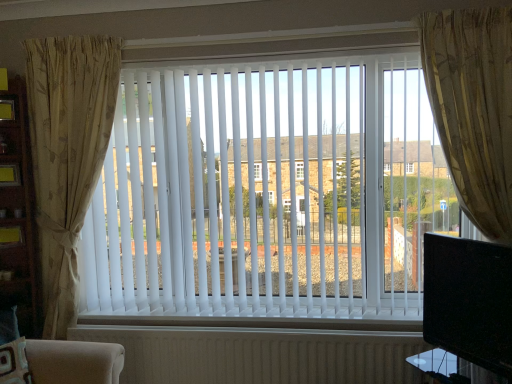
Describe the element at coordinates (267, 193) in the screenshot. The height and width of the screenshot is (384, 512). I see `white plastic blinds at center` at that location.

This screenshot has height=384, width=512. Describe the element at coordinates (67, 153) in the screenshot. I see `beige floral fabric curtain at left, which is the 1th curtain from left to right` at that location.

How much space does beige floral fabric curtain at left, which is the 1th curtain from left to right, occupy horizontally?

beige floral fabric curtain at left, which is the 1th curtain from left to right, is 5.63 inches in width.

Find the location of `white ribbed radiator at bottom`. white ribbed radiator at bottom is located at coordinates tap(259, 354).

Is white plastic blinds at center further to the viewer compared to beige floral fabric curtain at left, which ranks as the 2th curtain in right-to-left order?

No, the depth of white plastic blinds at center is less than that of beige floral fabric curtain at left, which ranks as the 2th curtain in right-to-left order.

Who is taller, white plastic blinds at center or beige floral fabric curtain at left, which ranks as the 2th curtain in right-to-left order?

Standing taller between the two is beige floral fabric curtain at left, which ranks as the 2th curtain in right-to-left order.

Considering the relative positions of white plastic blinds at center and beige floral fabric curtain at left, which ranks as the 2th curtain in right-to-left order, in the image provided, is white plastic blinds at center to the left or to the right of beige floral fabric curtain at left, which ranks as the 2th curtain in right-to-left order,?

Based on their positions, white plastic blinds at center is located to the right of beige floral fabric curtain at left, which ranks as the 2th curtain in right-to-left order.

Considering the relative sizes of white plastic blinds at center and beige floral fabric curtain at left, which ranks as the 2th curtain in right-to-left order, in the image provided, is white plastic blinds at center smaller than beige floral fabric curtain at left, which ranks as the 2th curtain in right-to-left order,?

Incorrect, white plastic blinds at center is not smaller in size than beige floral fabric curtain at left, which ranks as the 2th curtain in right-to-left order.

From the image's perspective, between white ribbed radiator at bottom and black glossy tv at right, which one is located above?

black glossy tv at right, from the image's perspective.

Can you confirm if white ribbed radiator at bottom is wider than black glossy tv at right?

Incorrect, the width of white ribbed radiator at bottom does not surpass that of black glossy tv at right.

Is white ribbed radiator at bottom bigger than black glossy tv at right?

Yes.

Is white ribbed radiator at bottom not inside black glossy tv at right?

Yes, white ribbed radiator at bottom is located beyond the bounds of black glossy tv at right.

The image size is (512, 384). Find the location of `curtain that is the 1st object above the white ribbed radiator at bottom (from a real-world perspective)`. curtain that is the 1st object above the white ribbed radiator at bottom (from a real-world perspective) is located at coordinates (67, 153).

Is point (207, 349) more distant than point (75, 203)?

Yes, point (207, 349) is behind point (75, 203).

Is white ribbed radiator at bottom positioned far away from beige floral fabric curtain at left, which is the 1th curtain from left to right?

That's right, there is a large distance between white ribbed radiator at bottom and beige floral fabric curtain at left, which is the 1th curtain from left to right.

Based on the photo, which is more to the left, white ribbed radiator at bottom or beige floral fabric curtain at left, which ranks as the 2th curtain in right-to-left order?

beige floral fabric curtain at left, which ranks as the 2th curtain in right-to-left order.

Is gold textured curtain at right, the 2th curtain viewed from the left, thinner than white ribbed radiator at bottom?

Incorrect, the width of gold textured curtain at right, the 2th curtain viewed from the left, is not less than that of white ribbed radiator at bottom.

Is point (493, 18) positioned before point (316, 329)?

Yes, it is in front of point (316, 329).

Are gold textured curtain at right, marked as the first curtain in a right-to-left arrangement, and white ribbed radiator at bottom beside each other?

No, gold textured curtain at right, marked as the first curtain in a right-to-left arrangement, is not in contact with white ribbed radiator at bottom.

What's the angular difference between gold textured curtain at right, marked as the first curtain in a right-to-left arrangement, and white ribbed radiator at bottom's facing directions?

The angular difference between gold textured curtain at right, marked as the first curtain in a right-to-left arrangement, and white ribbed radiator at bottom is 0.568 degrees.

Is white ribbed radiator at bottom not inside white plastic blinds at center?

white ribbed radiator at bottom lies outside white plastic blinds at center's area.

From the image's perspective, which one is positioned lower, white ribbed radiator at bottom or white plastic blinds at center?

white ribbed radiator at bottom is shown below in the image.

Considering the positions of point (412, 346) and point (317, 134), is point (412, 346) closer or farther from the camera than point (317, 134)?

Clearly, point (412, 346) is closer to the camera than point (317, 134).

Measure the distance from white ribbed radiator at bottom to white plastic blinds at center.

The distance of white ribbed radiator at bottom from white plastic blinds at center is 24.08 inches.

Is beige floral fabric curtain at left, which ranks as the 2th curtain in right-to-left order, looking in the opposite direction of white plastic blinds at center?

Absolutely, beige floral fabric curtain at left, which ranks as the 2th curtain in right-to-left order, is directed away from white plastic blinds at center.

Which is nearer, (40, 235) or (325, 117)?

The point (325, 117) is more forward.

Which of these two, beige floral fabric curtain at left, which is the 1th curtain from left to right, or white plastic blinds at center, is thinner?

white plastic blinds at center.

Considering the relative sizes of beige floral fabric curtain at left, which ranks as the 2th curtain in right-to-left order, and white plastic blinds at center in the image provided, is beige floral fabric curtain at left, which ranks as the 2th curtain in right-to-left order, taller than white plastic blinds at center?

Yes.

Who is smaller, beige floral fabric curtain at left, which ranks as the 2th curtain in right-to-left order, or black glossy tv at right?

Smaller between the two is black glossy tv at right.

Which is in front, point (49, 141) or point (430, 237)?

The point (430, 237) is closer to the camera.

From a real-world perspective, who is located lower, beige floral fabric curtain at left, which ranks as the 2th curtain in right-to-left order, or black glossy tv at right?

From a 3D spatial view, black glossy tv at right is below.

Is beige floral fabric curtain at left, which is the 1th curtain from left to right, to the left or to the right of black glossy tv at right in the image?

beige floral fabric curtain at left, which is the 1th curtain from left to right, is to the left of black glossy tv at right.

At what (x,y) coordinates should I click in order to perform the action: click on curtain that is the 2nd object directly below the white plastic blinds at center (from a real-world perspective). Please return your answer as a coordinate pair (x, y). The width and height of the screenshot is (512, 384). Looking at the image, I should click on (67, 153).

The height and width of the screenshot is (384, 512). What are the coordinates of `radiator to the left of black glossy tv at right` in the screenshot? It's located at (259, 354).

Based on their spatial positions, is black glossy tv at right or white ribbed radiator at bottom closer to gold textured curtain at right, marked as the first curtain in a right-to-left arrangement?

The object closer to gold textured curtain at right, marked as the first curtain in a right-to-left arrangement, is black glossy tv at right.

Estimate the real-world distances between objects in this image. Which object is further from gold textured curtain at right, marked as the first curtain in a right-to-left arrangement, black glossy tv at right or beige floral fabric curtain at left, which ranks as the 2th curtain in right-to-left order?

Among the two, beige floral fabric curtain at left, which ranks as the 2th curtain in right-to-left order, is located further to gold textured curtain at right, marked as the first curtain in a right-to-left arrangement.

When comparing their distances from beige floral fabric curtain at left, which is the 1th curtain from left to right, does white plastic blinds at center or gold textured curtain at right, marked as the first curtain in a right-to-left arrangement, seem further?

gold textured curtain at right, marked as the first curtain in a right-to-left arrangement, is positioned further to the anchor beige floral fabric curtain at left, which is the 1th curtain from left to right.

Based on their spatial positions, is white plastic blinds at center or gold textured curtain at right, the 2th curtain viewed from the left, closer to black glossy tv at right?

gold textured curtain at right, the 2th curtain viewed from the left.

Considering their positions, is black glossy tv at right positioned further to beige floral fabric curtain at left, which ranks as the 2th curtain in right-to-left order, than white ribbed radiator at bottom?

black glossy tv at right.

Estimate the real-world distances between objects in this image. Which object is further from gold textured curtain at right, marked as the first curtain in a right-to-left arrangement, white plastic blinds at center or white ribbed radiator at bottom?

white ribbed radiator at bottom is further to gold textured curtain at right, marked as the first curtain in a right-to-left arrangement.

Considering their positions, is white plastic blinds at center positioned closer to beige floral fabric curtain at left, which ranks as the 2th curtain in right-to-left order, than black glossy tv at right?

white plastic blinds at center is positioned closer to the anchor beige floral fabric curtain at left, which ranks as the 2th curtain in right-to-left order.

Considering their positions, is beige floral fabric curtain at left, which is the 1th curtain from left to right, positioned closer to white plastic blinds at center than white ribbed radiator at bottom?

white ribbed radiator at bottom is closer to white plastic blinds at center.

Where is `window screen between beige floral fabric curtain at left, which ranks as the 2th curtain in right-to-left order, and gold textured curtain at right, the 2th curtain viewed from the left, from left to right`? window screen between beige floral fabric curtain at left, which ranks as the 2th curtain in right-to-left order, and gold textured curtain at right, the 2th curtain viewed from the left, from left to right is located at coordinates (468, 297).

What are the coordinates of `radiator located between beige floral fabric curtain at left, which ranks as the 2th curtain in right-to-left order, and white plastic blinds at center in the left-right direction` in the screenshot? It's located at (259, 354).

What are the coordinates of `window screen between white ribbed radiator at bottom and gold textured curtain at right, marked as the first curtain in a right-to-left arrangement, in the horizontal direction` in the screenshot? It's located at (468, 297).

Identify the location of window blind between beige floral fabric curtain at left, which ranks as the 2th curtain in right-to-left order, and black glossy tv at right. This screenshot has height=384, width=512. (267, 193).